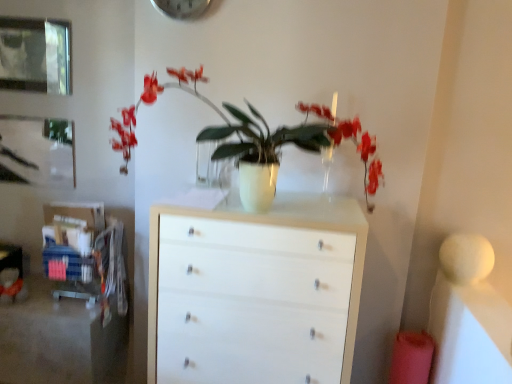
You are a GUI agent. You are given a task and a screenshot of the screen. Output one action in this format:
    pyautogui.click(x=<x>, y=<y>)
    Task: Click on the free space above white glossy chest of drawers at center (from a real-world perspective)
    This screenshot has width=512, height=384.
    Given the screenshot: What is the action you would take?
    pyautogui.click(x=286, y=203)